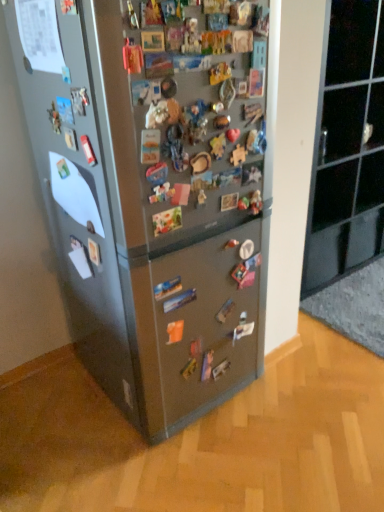
Image resolution: width=384 pixels, height=512 pixels. What do you see at coordinates (347, 146) in the screenshot? I see `black glass cabinet at upper right` at bounding box center [347, 146].

Image resolution: width=384 pixels, height=512 pixels. What are the coordinates of `black glass cabinet at upper right` in the screenshot? It's located at (347, 146).

Image resolution: width=384 pixels, height=512 pixels. What do you see at coordinates (154, 190) in the screenshot?
I see `satin silver fridge at center` at bounding box center [154, 190].

Locate an element on the screen. The image size is (384, 512). satin silver fridge at center is located at coordinates (154, 190).

This screenshot has height=512, width=384. I want to click on black glass cabinet at upper right, so click(347, 146).

Is black glass cabinet at upper right to the right of satin silver fridge at center from the viewer's perspective?

Yes, black glass cabinet at upper right is to the right of satin silver fridge at center.

Is black glass cabinet at upper right further to the viewer compared to satin silver fridge at center?

Yes, black glass cabinet at upper right is further from the camera.

Does point (348, 178) come farther from viewer compared to point (69, 29)?

Yes, it is behind point (69, 29).

From the image's perspective, between black glass cabinet at upper right and satin silver fridge at center, who is located below?

satin silver fridge at center.

From a real-world perspective, between black glass cabinet at upper right and satin silver fridge at center, who is vertically lower?

black glass cabinet at upper right.

Does black glass cabinet at upper right have a greater width compared to satin silver fridge at center?

In fact, black glass cabinet at upper right might be narrower than satin silver fridge at center.

In terms of height, does black glass cabinet at upper right look taller or shorter compared to satin silver fridge at center?

Considering their sizes, black glass cabinet at upper right has less height than satin silver fridge at center.

Does black glass cabinet at upper right have a larger size compared to satin silver fridge at center?

Incorrect, black glass cabinet at upper right is not larger than satin silver fridge at center.

Can we say black glass cabinet at upper right lies outside satin silver fridge at center?

Absolutely, black glass cabinet at upper right is external to satin silver fridge at center.

Does black glass cabinet at upper right touch satin silver fridge at center?

No, black glass cabinet at upper right is not next to satin silver fridge at center.

Could you tell me if black glass cabinet at upper right is turned towards satin silver fridge at center?

No, black glass cabinet at upper right is not aimed at satin silver fridge at center.

How many degrees apart are the facing directions of black glass cabinet at upper right and satin silver fridge at center?

0.317 degrees separate the facing orientations of black glass cabinet at upper right and satin silver fridge at center.

Based on the photo, how much distance is there between black glass cabinet at upper right and satin silver fridge at center?

black glass cabinet at upper right is 3.49 feet away from satin silver fridge at center.

Find the location of a particular element. The image size is (384, 512). refrigerator below the black glass cabinet at upper right (from the image's perspective) is located at coordinates (154, 190).

Is satin silver fridge at center at the right side of black glass cabinet at upper right?

No, satin silver fridge at center is not to the right of black glass cabinet at upper right.

Is satin silver fridge at center in front of black glass cabinet at upper right?

Yes, it is.

Does point (189, 220) come closer to viewer compared to point (361, 185)?

Yes, point (189, 220) is in front of point (361, 185).

From the image's perspective, is satin silver fridge at center located beneath black glass cabinet at upper right?

Yes, from the image's perspective, satin silver fridge at center is below black glass cabinet at upper right.

From a real-world perspective, between satin silver fridge at center and black glass cabinet at upper right, who is vertically higher?

From a 3D spatial view, satin silver fridge at center is above.

Is satin silver fridge at center wider or thinner than black glass cabinet at upper right?

Considering their sizes, satin silver fridge at center looks broader than black glass cabinet at upper right.

Is satin silver fridge at center shorter than black glass cabinet at upper right?

No, satin silver fridge at center is not shorter than black glass cabinet at upper right.

Considering the relative sizes of satin silver fridge at center and black glass cabinet at upper right in the image provided, is satin silver fridge at center smaller than black glass cabinet at upper right?

No.

Is satin silver fridge at center situated inside black glass cabinet at upper right or outside?

satin silver fridge at center cannot be found inside black glass cabinet at upper right.

Would you say satin silver fridge at center is a long distance from black glass cabinet at upper right?

Yes, satin silver fridge at center is far from black glass cabinet at upper right.

Could you tell me if satin silver fridge at center is turned towards black glass cabinet at upper right?

No, satin silver fridge at center is not facing towards black glass cabinet at upper right.

Can you tell me how much satin silver fridge at center and black glass cabinet at upper right differ in facing direction?

The angle between the facing direction of satin silver fridge at center and the facing direction of black glass cabinet at upper right is 0.317 degrees.

I want to click on refrigerator that is below the black glass cabinet at upper right (from the image's perspective), so click(154, 190).

Find the location of `cabinetry that is behind the satin silver fridge at center`. cabinetry that is behind the satin silver fridge at center is located at coordinates (347, 146).

The height and width of the screenshot is (512, 384). I want to click on refrigerator below the black glass cabinet at upper right (from the image's perspective), so click(154, 190).